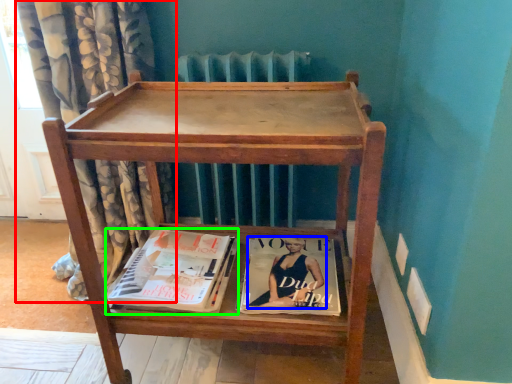
Question: Estimate the real-world distances between objects in this image. Which object is closer to curtain (highlighted by a red box), person (highlighted by a blue box) or book (highlighted by a green box)?

Choices:
 (A) person
 (B) book

Answer: (B)